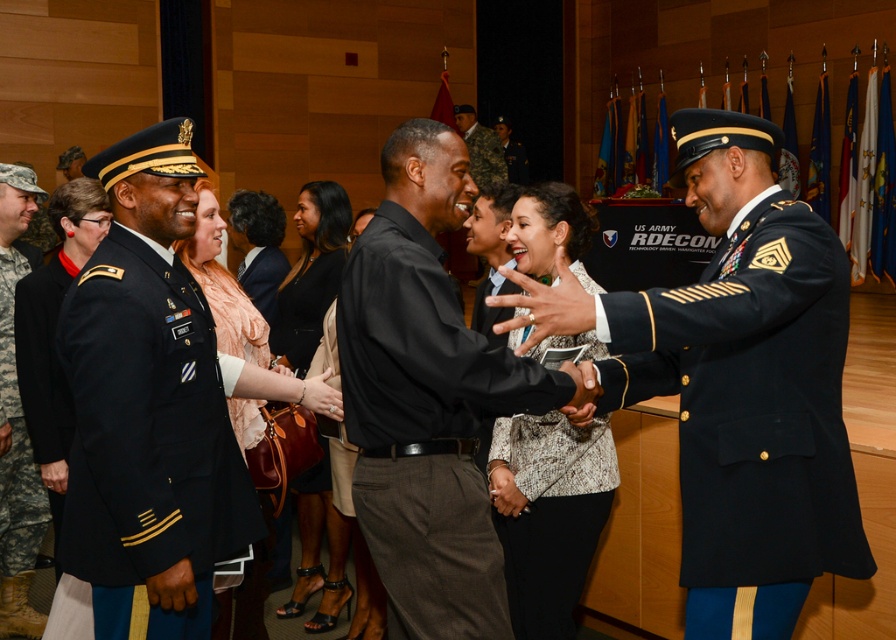
Between patterned fabric blouse at center and black leather dress at center, which one is positioned lower?

patterned fabric blouse at center is lower down.

Who is more forward, (526,476) or (306,545)?

Positioned in front is point (526,476).

Locate an element on the screen. patterned fabric blouse at center is located at coordinates (548, 513).

Locate an element on the screen. This screenshot has width=896, height=640. patterned fabric blouse at center is located at coordinates tap(548, 513).

Is dark blue wool military jacket at right taller than camouflage fabric uniform at left?

In fact, dark blue wool military jacket at right may be shorter than camouflage fabric uniform at left.

Can you confirm if dark blue wool military jacket at right is positioned to the left of camouflage fabric uniform at left?

In fact, dark blue wool military jacket at right is to the right of camouflage fabric uniform at left.

Is point (660, 353) closer to camera compared to point (6, 262)?

That is True.

Where is `dark blue wool military jacket at right`? This screenshot has width=896, height=640. dark blue wool military jacket at right is located at coordinates (751, 408).

Who is positioned more to the right, matte peach dress at center or camouflage fabric uniform at left?

matte peach dress at center

This screenshot has height=640, width=896. What are the coordinates of `matte peach dress at center` in the screenshot? It's located at (242, 332).